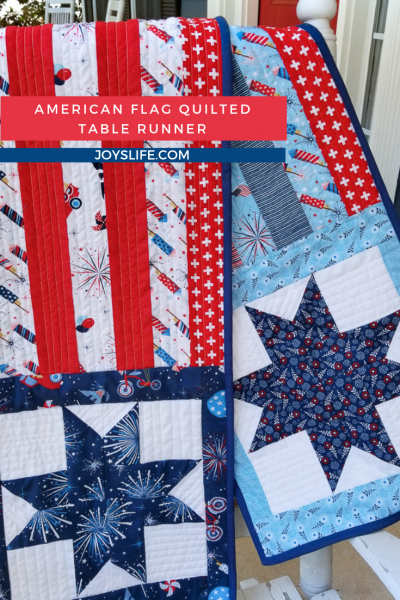
You are a GUI agent. You are given a task and a screenshot of the screen. Output one action in this format:
    pyautogui.click(x=<x>, y=<y>)
    Task: Click on the chair backs
    The width and height of the screenshot is (400, 600).
    Given the screenshot: What is the action you would take?
    pyautogui.click(x=111, y=14), pyautogui.click(x=55, y=14)